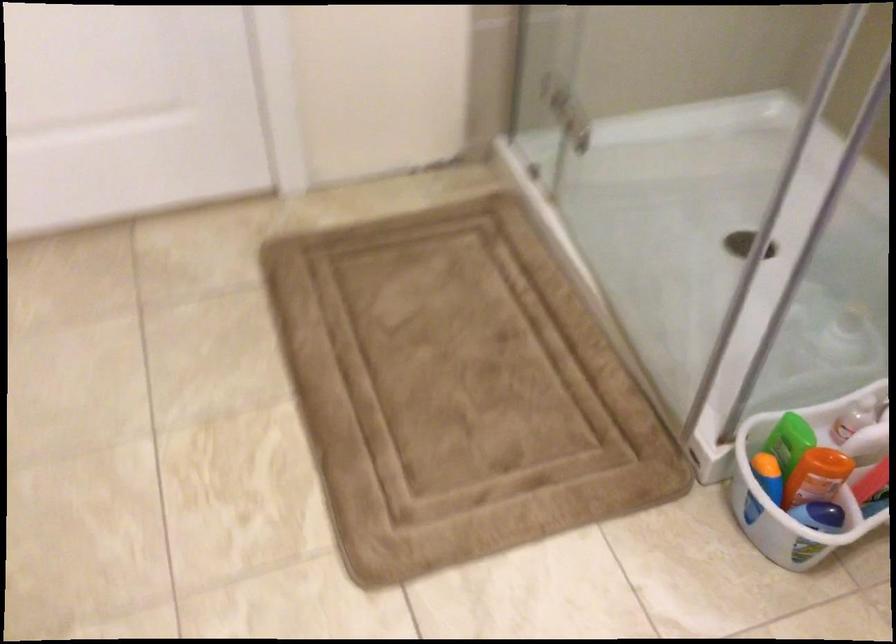
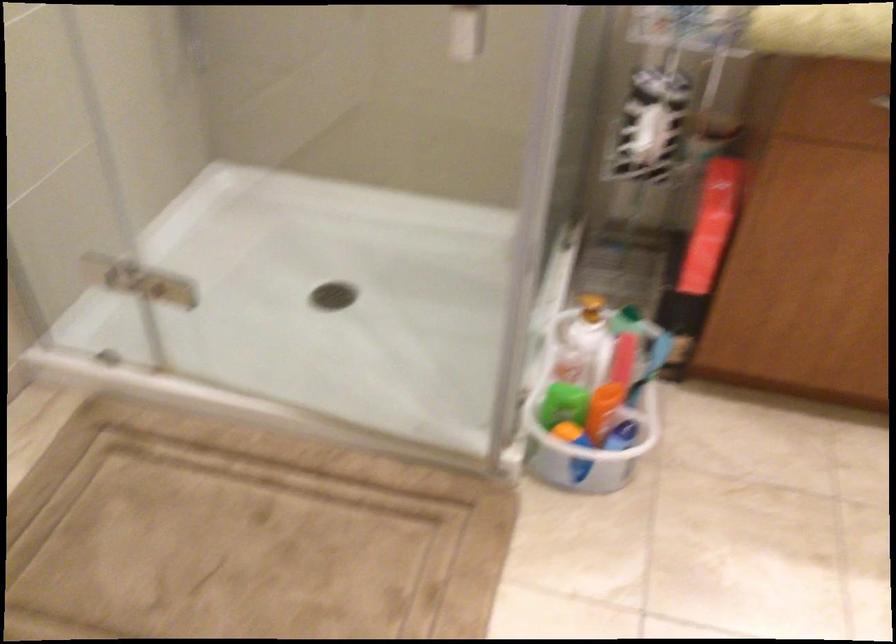
The point at (814, 458) is marked in the first image. Where is the corresponding point in the second image?

(595, 397)